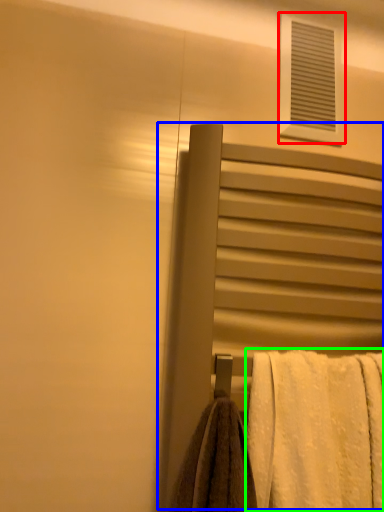
Question: Which object is the farthest from window (highlighted by a red box)? Choose among these: screen door (highlighted by a blue box) or towel (highlighted by a green box).

Choices:
 (A) screen door
 (B) towel

Answer: (B)